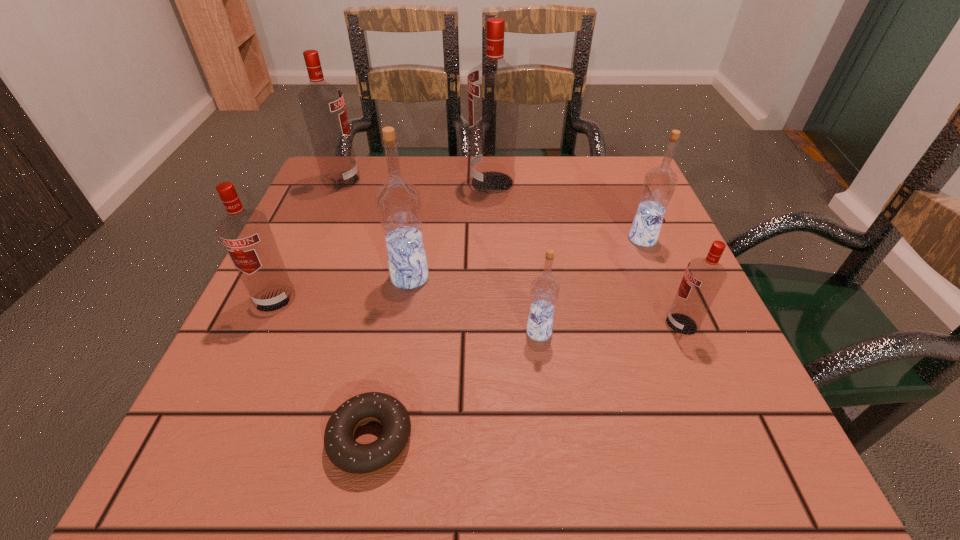
Where is `free point located 0.060m on the front label of the smallest red vodka`? The image size is (960, 540). free point located 0.060m on the front label of the smallest red vodka is located at coordinates (631, 325).

At what (x,y) coordinates should I click in order to perform the action: click on blank area located on the front label of the smallest red vodka. Please return your answer as a coordinate pair (x, y). Looking at the image, I should click on (595, 325).

Locate an element on the screen. The height and width of the screenshot is (540, 960). free space located 0.090m on the front label of the smallest red vodka is located at coordinates (612, 325).

You are a GUI agent. You are given a task and a screenshot of the screen. Output one action in this format:
    pyautogui.click(x=<x>, y=<y>)
    Task: Click on the free space located on the back of the nearest blue vodka
    Image resolution: width=960 pixels, height=540 pixels.
    Given the screenshot: What is the action you would take?
    pyautogui.click(x=529, y=247)

Find the location of a particular element. Image resolution: width=960 pixels, height=540 pixels. vacant position located on the right of the nearest object is located at coordinates (672, 439).

This screenshot has height=540, width=960. Find the location of `object that is at the near edge`. object that is at the near edge is located at coordinates (345, 453).

Locate an element on the screen. The width and height of the screenshot is (960, 540). object that is at the far left corner is located at coordinates (322, 104).

This screenshot has width=960, height=540. In the image, there is a desktop. What are the coordinates of `vacant area at the far edge` in the screenshot? It's located at (477, 201).

At what (x,y) coordinates should I click in order to perform the action: click on blank area at the near edge. Please return your answer as a coordinate pair (x, y). This screenshot has width=960, height=540. Looking at the image, I should click on (640, 481).

Image resolution: width=960 pixels, height=540 pixels. I want to click on vacant space at the left edge of the desktop, so click(332, 223).